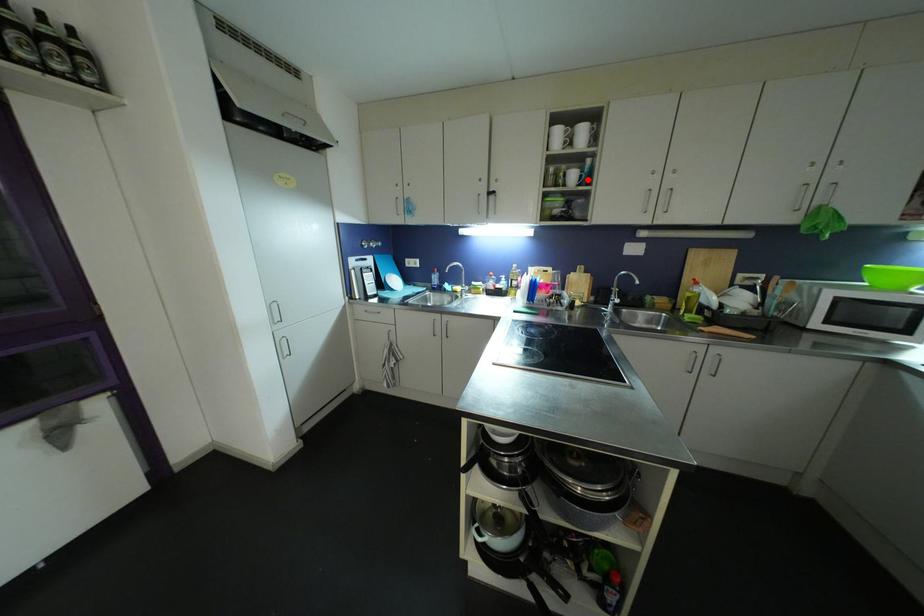
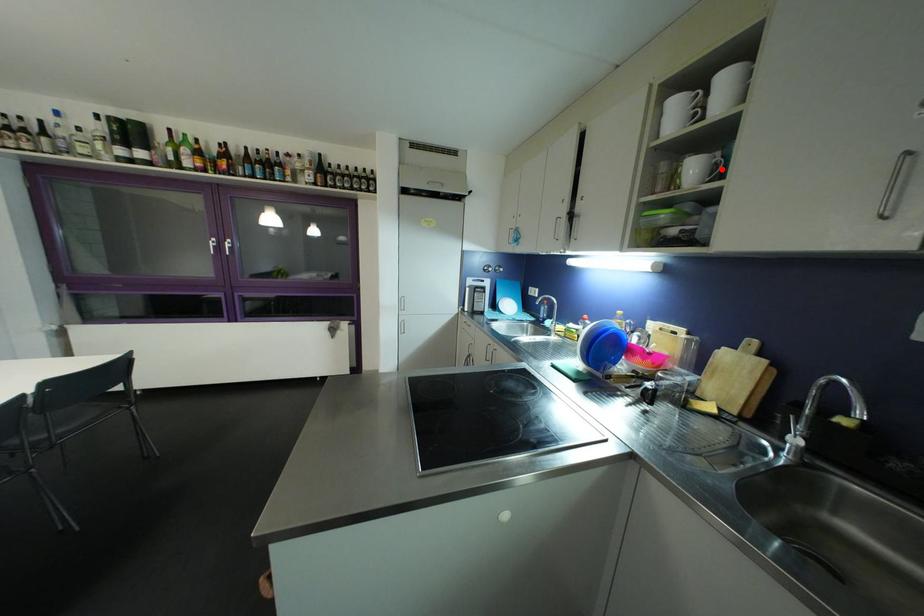
I am providing you with two images of the same scene from different viewpoints. A red point is marked on the first image and another point is marked on the second image. Do the highlighted points in image1 and image2 indicate the same real-world spot?

Yes